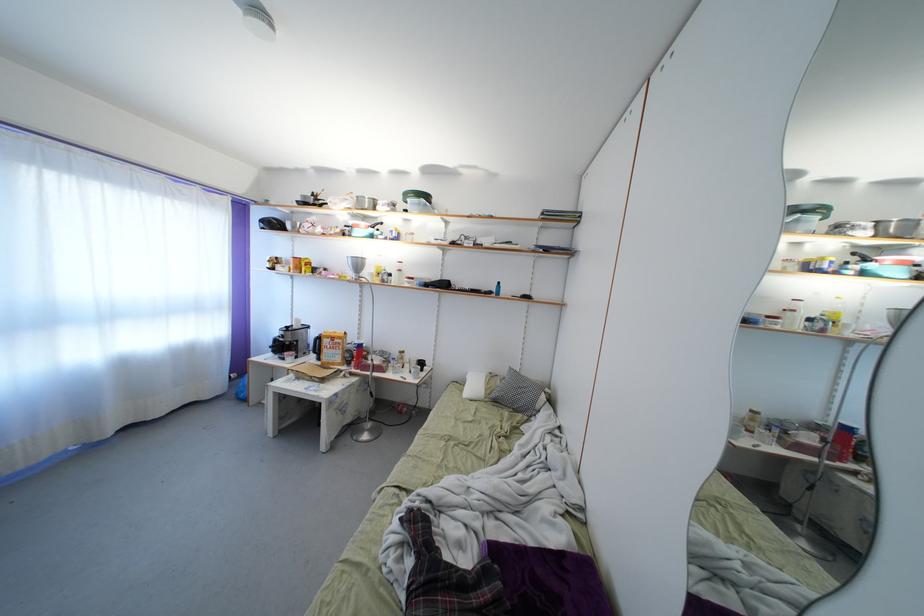
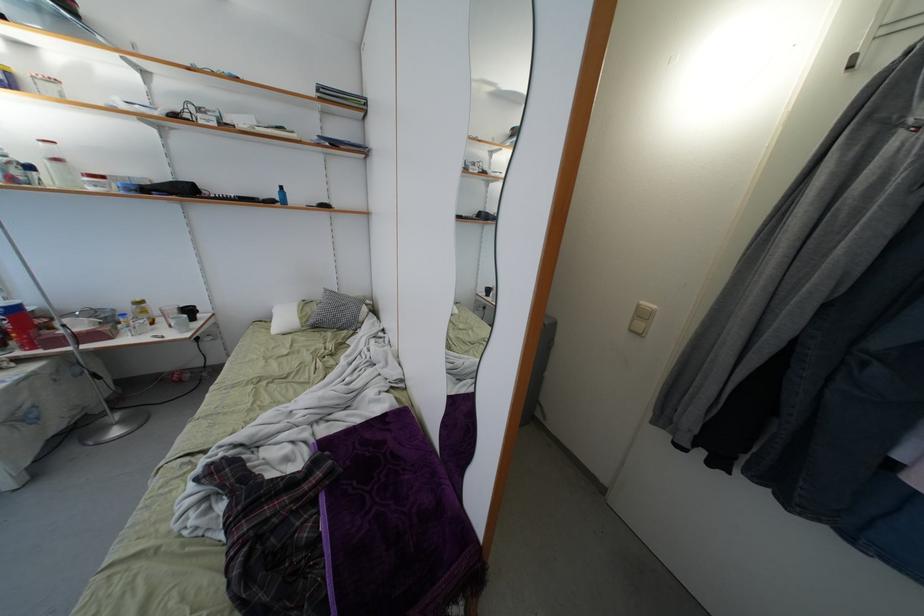
Locate, in the second image, the point that corresponds to (x=407, y=363) in the first image.

(149, 317)